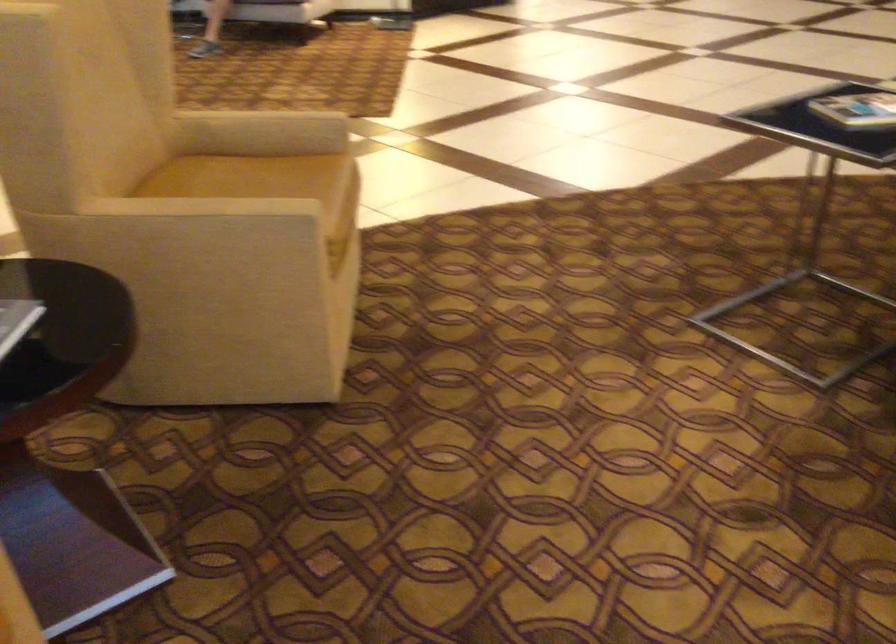
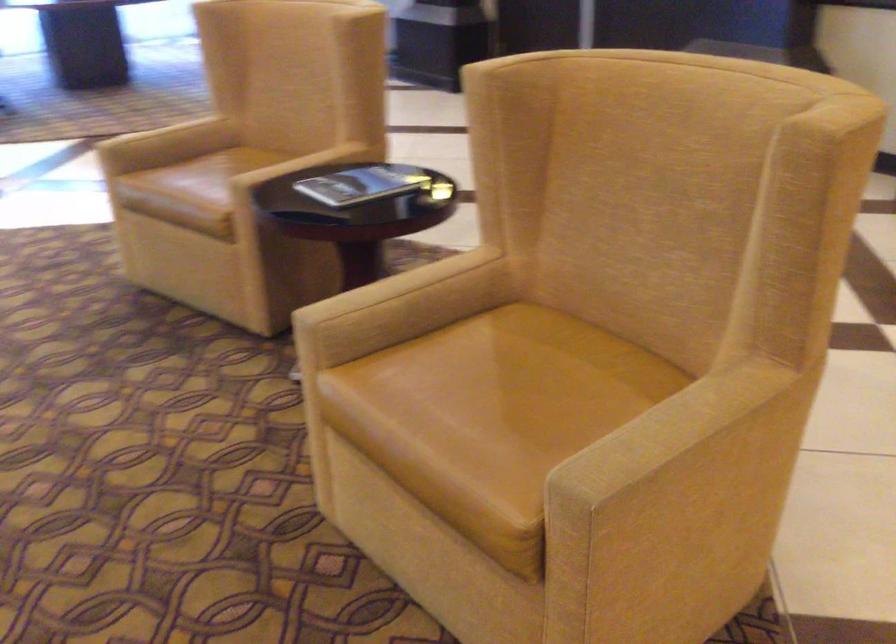
Locate, in the second image, the point that corresponds to point (211, 216) in the first image.

(394, 286)